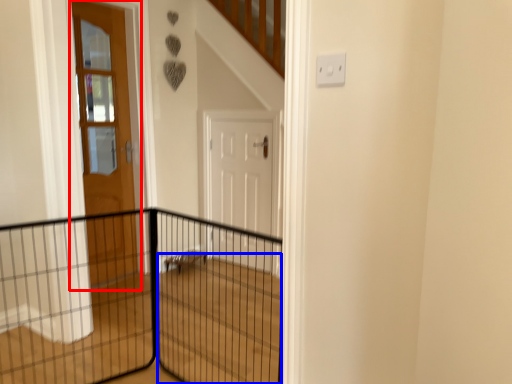
Question: Among these objects, which one is nearest to the camera, door (highlighted by a red box) or stairwell (highlighted by a blue box)?

Choices:
 (A) door
 (B) stairwell

Answer: (B)